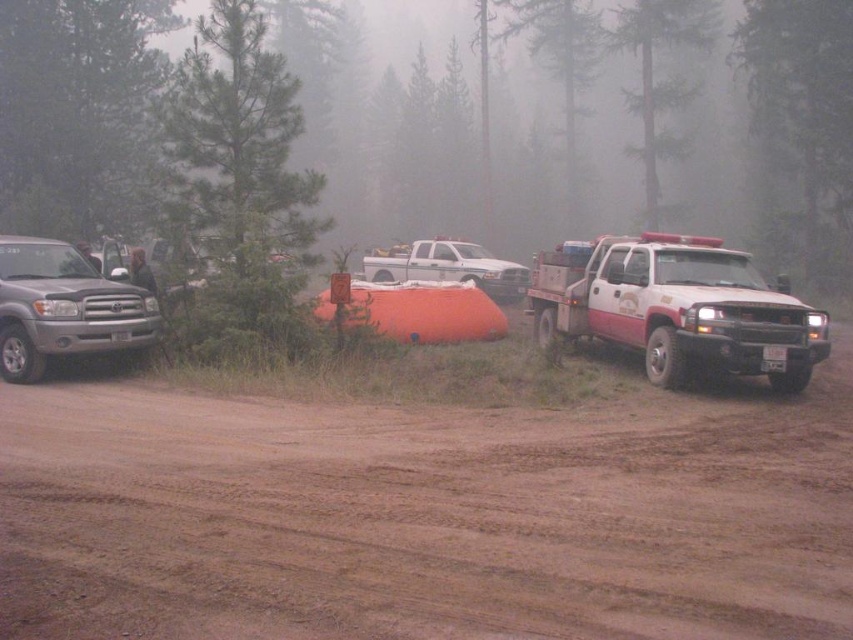
Is point (74, 476) behind point (659, 380)?

No, (74, 476) is closer to viewer.

Is dull brown dirt at center shorter than white matte tow truck at right?

Yes.

Where is `dull brown dirt at center`? This screenshot has height=640, width=853. dull brown dirt at center is located at coordinates (426, 516).

You are a GUI agent. You are given a task and a screenshot of the screen. Output one action in this format:
    pyautogui.click(x=<x>, y=<y>)
    Task: Click on the dull brown dirt at center
    Image resolution: width=853 pixels, height=640 pixels.
    Given the screenshot: What is the action you would take?
    pyautogui.click(x=426, y=516)

Does dull brown dirt at center have a smaller size compared to white matte truck at center?

Yes, dull brown dirt at center is smaller than white matte truck at center.

Between dull brown dirt at center and white matte truck at center, which one appears on the left side from the viewer's perspective?

From the viewer's perspective, dull brown dirt at center appears more on the left side.

Is point (722, 429) less distant than point (436, 252)?

Yes, it is in front of point (436, 252).

Where is `dull brown dirt at center`? dull brown dirt at center is located at coordinates (426, 516).

Between dull brown dirt at center and satin silver truck at left, which one appears on the left side from the viewer's perspective?

From the viewer's perspective, satin silver truck at left appears more on the left side.

Can you confirm if dull brown dirt at center is positioned to the right of satin silver truck at left?

Yes, dull brown dirt at center is to the right of satin silver truck at left.

Does point (762, 593) come farther from viewer compared to point (15, 330)?

That is False.

At what (x,y) coordinates should I click in order to perform the action: click on dull brown dirt at center. Please return your answer as a coordinate pair (x, y). Looking at the image, I should click on (426, 516).